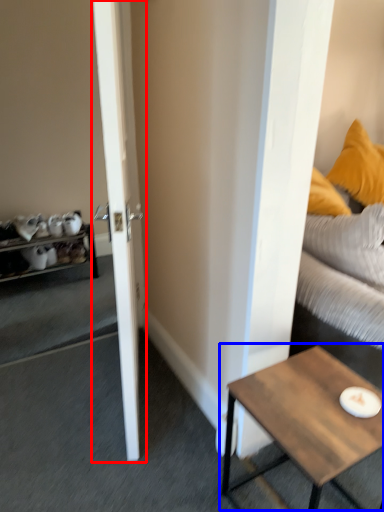
Question: Which point is closer to the camera, door (highlighted by a red box) or coffee table (highlighted by a blue box)?

Choices:
 (A) door
 (B) coffee table

Answer: (A)